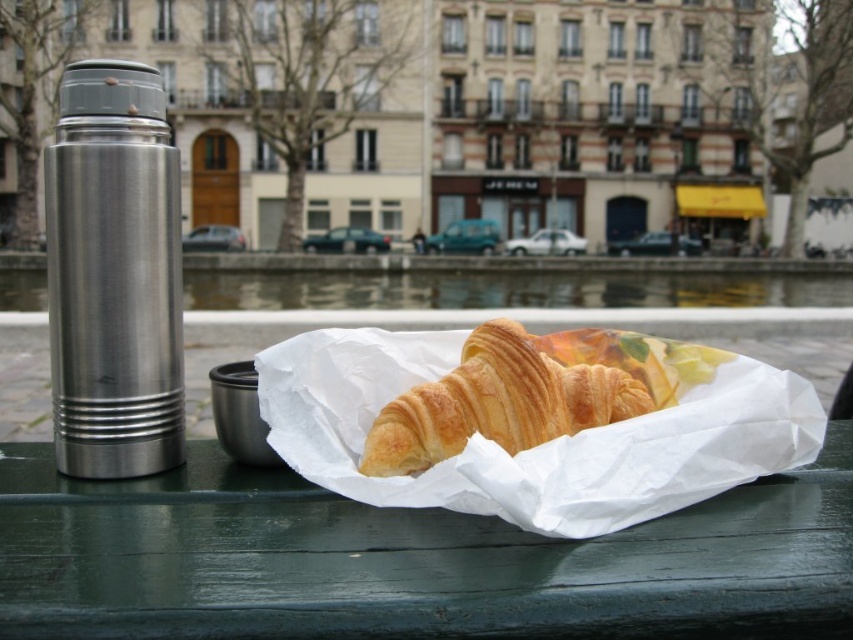
Question: Among these points, which one is farthest from the camera?

Choices:
 (A) (471, 388)
 (B) (842, 472)

Answer: (B)

Question: Which point is farther to the camera?

Choices:
 (A) green painted wood table at center
 (B) golden brown croissant at center

Answer: (B)

Question: Is green painted wood table at center smaller than golden brown croissant at center?

Choices:
 (A) yes
 (B) no

Answer: (B)

Question: Considering the relative positions of green painted wood table at center and golden brown croissant at center in the image provided, where is green painted wood table at center located with respect to golden brown croissant at center?

Choices:
 (A) below
 (B) above

Answer: (A)

Question: Is green painted wood table at center thinner than golden brown croissant at center?

Choices:
 (A) no
 (B) yes

Answer: (A)

Question: Among these objects, which one is farthest from the camera?

Choices:
 (A) green painted wood table at center
 (B) golden brown croissant at center

Answer: (B)